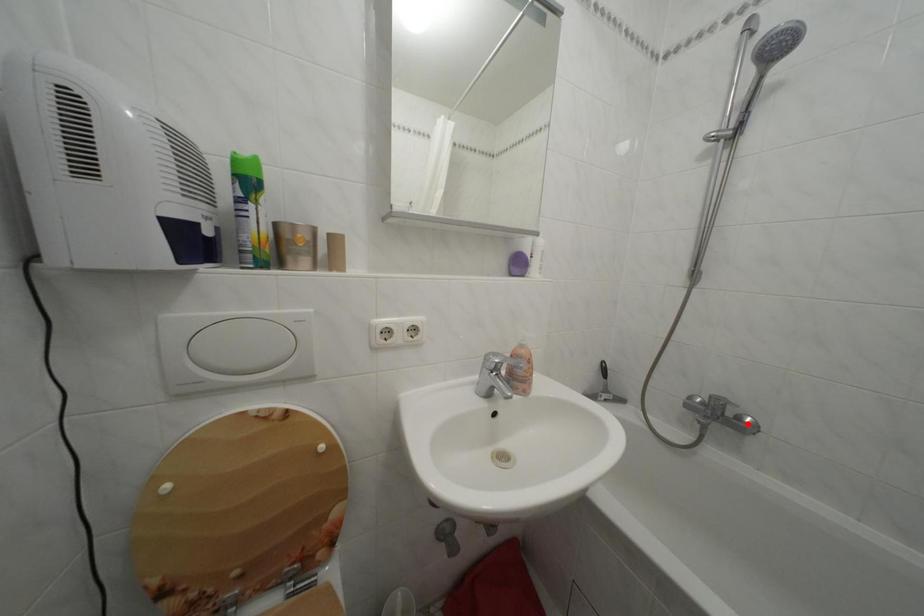
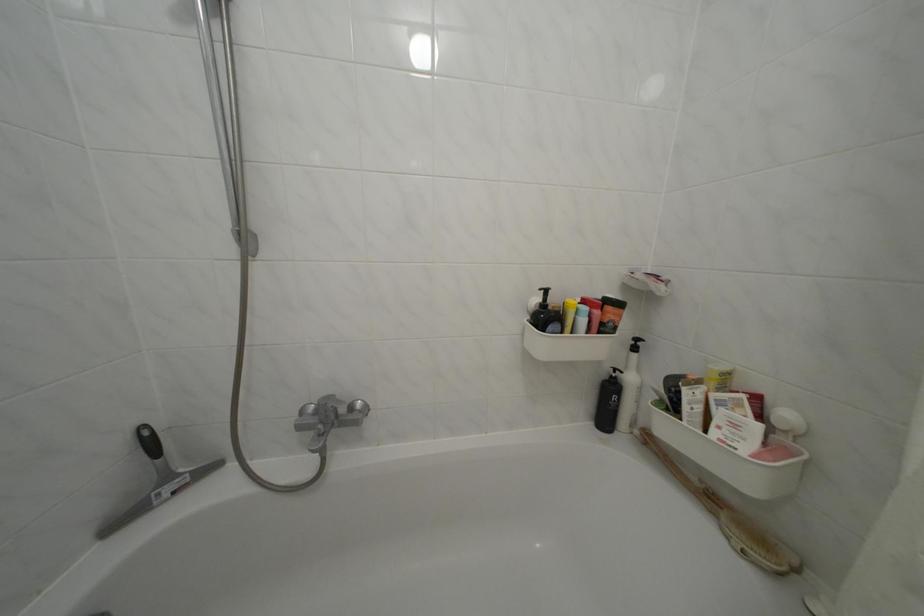
Locate, in the second image, the point that corresponds to the highlighted location in the first image.

(359, 414)